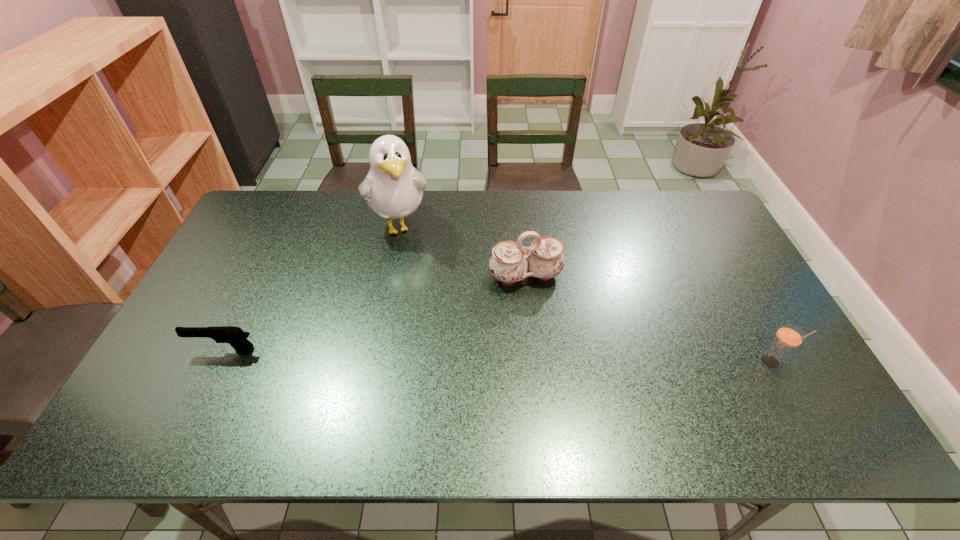
Where is `pistol`? This screenshot has width=960, height=540. pistol is located at coordinates pos(235,336).

Where is `the shortest object`? Image resolution: width=960 pixels, height=540 pixels. the shortest object is located at coordinates (235, 336).

At what (x,y) coordinates should I click in order to perform the action: click on the rightmost object. Please return your answer as a coordinate pair (x, y). This screenshot has width=960, height=540. Looking at the image, I should click on (789, 336).

The width and height of the screenshot is (960, 540). I want to click on the third object from right to left, so tap(393, 188).

At what (x,y) coordinates should I click in order to perform the action: click on the farthest object. Please return your answer as a coordinate pair (x, y). The width and height of the screenshot is (960, 540). Looking at the image, I should click on tap(393, 188).

Identify the location of the second object from right to left. This screenshot has width=960, height=540. (509, 263).

I want to click on chinaware, so click(509, 263).

Locate an element on the screen. Image resolution: width=960 pixels, height=540 pixels. vacant space located 0.350m on the left of the rightmost object is located at coordinates (622, 362).

You are a GUI agent. You are given a task and a screenshot of the screen. Output one action in this format:
    pyautogui.click(x=<x>, y=<y>)
    Task: Click on the vacant region located on the beak of the gull
    Image resolution: width=960 pixels, height=540 pixels.
    Given the screenshot: What is the action you would take?
    pyautogui.click(x=419, y=294)

Find the location of a particular element. The height and width of the screenshot is (540, 960). vacant point located 0.210m on the beak of the gull is located at coordinates (420, 297).